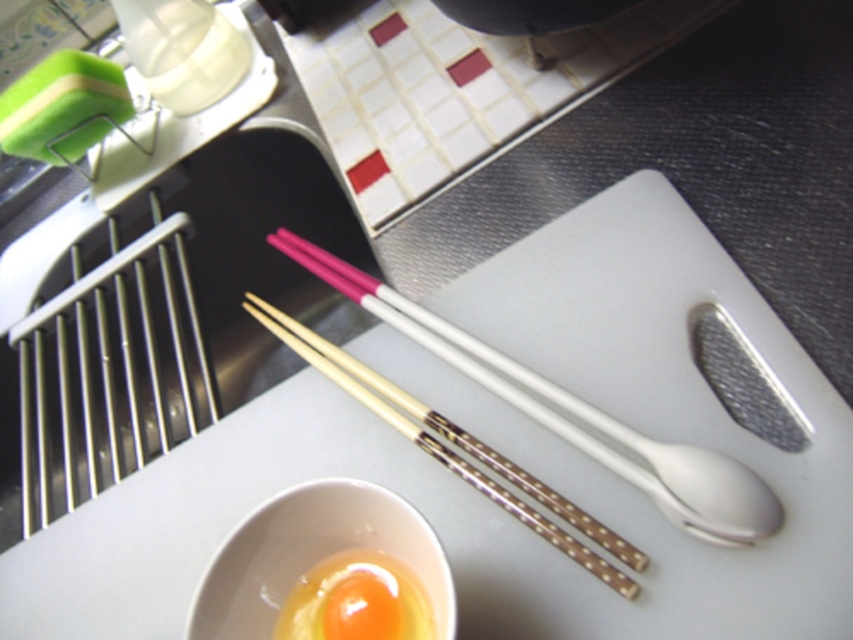
Question: Which object is closer to the camera taking this photo?

Choices:
 (A) smooth yellow egg at center
 (B) white plastic spoon at center
 (C) white ceramic bowl at lower center

Answer: (C)

Question: From the image, what is the correct spatial relationship of white plastic spoon at center in relation to wooden chopsticks at center?

Choices:
 (A) right
 (B) left

Answer: (A)

Question: Based on their relative distances, which object is nearer to the white ceramic bowl at lower center?

Choices:
 (A) white plastic spoon at center
 (B) wooden chopsticks at center

Answer: (B)

Question: Estimate the real-world distances between objects in this image. Which object is farther from the smooth yellow egg at center?

Choices:
 (A) white plastic spoon at center
 (B) wooden chopsticks at center

Answer: (A)

Question: Can you confirm if white plastic spoon at center is bigger than wooden chopsticks at center?

Choices:
 (A) no
 (B) yes

Answer: (A)

Question: Does wooden chopsticks at center appear on the right side of smooth yellow egg at center?

Choices:
 (A) yes
 (B) no

Answer: (A)